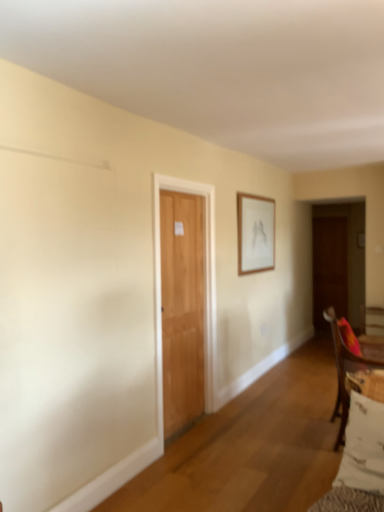
The width and height of the screenshot is (384, 512). I want to click on vacant area situated below light brown wooden door at center, which is the second door from back to front (from a real-world perspective), so click(199, 428).